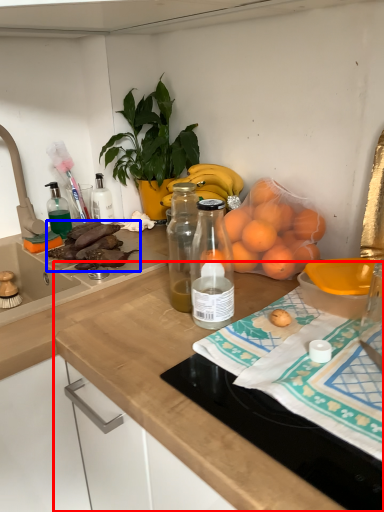
Question: Which point is further to the camera, countertop (highlighted by a red box) or food (highlighted by a blue box)?

Choices:
 (A) countertop
 (B) food

Answer: (B)